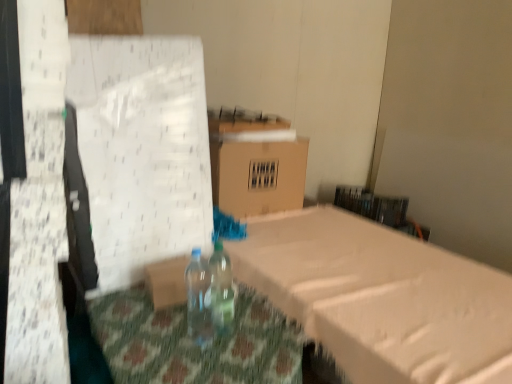
In order to face brown cardboard box at center, should I rotate leftwards or rightwards?

Rotate left and turn 0.758 degrees.

What do you see at coordinates (199, 299) in the screenshot?
I see `translucent plastic bottle at center, which is the second bottle in right-to-left order` at bounding box center [199, 299].

How much space does transparent plastic bottle at center, the 2th bottle when ordered from left to right, occupy horizontally?

3.36 inches.

The image size is (512, 384). I want to click on brown cardboard box at center, so click(255, 163).

Does point (292, 158) appear closer or farther from the camera than point (199, 304)?

Point (292, 158).

Which object is positioned more to the left, brown cardboard box at center or translucent plastic bottle at center, the 1th bottle from the left?

translucent plastic bottle at center, the 1th bottle from the left, is more to the left.

Is brown cardboard box at center not inside translucent plastic bottle at center, which is the second bottle in right-to-left order?

Yes, brown cardboard box at center is outside of translucent plastic bottle at center, which is the second bottle in right-to-left order.

Is brown cardboard box at center positioned behind translucent plastic bottle at center, the 1th bottle from the left?

Yes, brown cardboard box at center is behind translucent plastic bottle at center, the 1th bottle from the left.

This screenshot has height=384, width=512. I want to click on cardboard box on the right side of transparent plastic bottle at center, the first bottle when ordered from right to left, so click(x=255, y=163).

Between point (229, 267) and point (271, 176), which one is positioned behind?

The point (271, 176) is behind.

Looking at this image, from a real-world perspective, is transparent plastic bottle at center, the 2th bottle when ordered from left to right, located beneath brown cardboard box at center?

Yes, from a real-world perspective, transparent plastic bottle at center, the 2th bottle when ordered from left to right, is under brown cardboard box at center.

Is transparent plastic bottle at center, the 2th bottle when ordered from left to right, wider than brown cardboard box at center?

No, transparent plastic bottle at center, the 2th bottle when ordered from left to right, is not wider than brown cardboard box at center.

Can you confirm if brown cardboard box at center is taller than transparent plastic bottle at center, the 2th bottle when ordered from left to right?

Correct, brown cardboard box at center is much taller as transparent plastic bottle at center, the 2th bottle when ordered from left to right.

Is there a large distance between brown cardboard box at center and transparent plastic bottle at center, the 2th bottle when ordered from left to right?

No, brown cardboard box at center is in close proximity to transparent plastic bottle at center, the 2th bottle when ordered from left to right.

Who is smaller, brown cardboard box at center or transparent plastic bottle at center, the 2th bottle when ordered from left to right?

transparent plastic bottle at center, the 2th bottle when ordered from left to right.

Considering the sizes of objects brown cardboard box at center and transparent plastic bottle at center, the first bottle when ordered from right to left, in the image provided, who is wider, brown cardboard box at center or transparent plastic bottle at center, the first bottle when ordered from right to left,?

brown cardboard box at center is wider.

Is translucent plastic bottle at center, the 1th bottle from the left, positioned with its back to transparent plastic bottle at center, the first bottle when ordered from right to left?

No, translucent plastic bottle at center, the 1th bottle from the left,'s orientation is not away from transparent plastic bottle at center, the first bottle when ordered from right to left.

Considering the relative positions of translucent plastic bottle at center, the 1th bottle from the left, and transparent plastic bottle at center, the first bottle when ordered from right to left, in the image provided, is translucent plastic bottle at center, the 1th bottle from the left, behind transparent plastic bottle at center, the first bottle when ordered from right to left,?

No, translucent plastic bottle at center, the 1th bottle from the left, is closer to the camera.

In the scene shown: Between translucent plastic bottle at center, which is the second bottle in right-to-left order, and transparent plastic bottle at center, the first bottle when ordered from right to left, which one has less height?

transparent plastic bottle at center, the first bottle when ordered from right to left, is shorter.

From a real-world perspective, between translucent plastic bottle at center, which is the second bottle in right-to-left order, and brown cardboard box at center, who is vertically lower?

translucent plastic bottle at center, which is the second bottle in right-to-left order, from a real-world perspective.

You are a GUI agent. You are given a task and a screenshot of the screen. Output one action in this format:
    pyautogui.click(x=<x>, y=<y>)
    Task: Click on the cardboard box that is above the translucent plastic bottle at center, the 1th bottle from the left (from a real-world perspective)
    
    Given the screenshot: What is the action you would take?
    pyautogui.click(x=255, y=163)

Between translucent plastic bottle at center, which is the second bottle in right-to-left order, and brown cardboard box at center, which one has smaller size?

translucent plastic bottle at center, which is the second bottle in right-to-left order, is smaller.

Can you tell me how much transparent plastic bottle at center, the first bottle when ordered from right to left, and translucent plastic bottle at center, the 1th bottle from the left, differ in facing direction?

0.000565 degrees separate the facing orientations of transparent plastic bottle at center, the first bottle when ordered from right to left, and translucent plastic bottle at center, the 1th bottle from the left.

Does transparent plastic bottle at center, the first bottle when ordered from right to left, have a lesser width compared to translucent plastic bottle at center, which is the second bottle in right-to-left order?

Correct, the width of transparent plastic bottle at center, the first bottle when ordered from right to left, is less than that of translucent plastic bottle at center, which is the second bottle in right-to-left order.

Is transparent plastic bottle at center, the first bottle when ordered from right to left, not inside translucent plastic bottle at center, which is the second bottle in right-to-left order?

Yes, transparent plastic bottle at center, the first bottle when ordered from right to left, is not within translucent plastic bottle at center, which is the second bottle in right-to-left order.

Is there a large distance between transparent plastic bottle at center, the 2th bottle when ordered from left to right, and translucent plastic bottle at center, the 1th bottle from the left?

Actually, transparent plastic bottle at center, the 2th bottle when ordered from left to right, and translucent plastic bottle at center, the 1th bottle from the left, are a little close together.

Find the location of a particular element. bottle that is the 2nd object to the left of the brown cardboard box at center, starting at the anchor is located at coordinates (199, 299).

Identify the location of the 1st bottle in front of the brown cardboard box at center. (222, 290).

Considering their positions, is brown cardboard box at center positioned further to translucent plastic bottle at center, the 1th bottle from the left, than transparent plastic bottle at center, the first bottle when ordered from right to left?

brown cardboard box at center is positioned further to the anchor translucent plastic bottle at center, the 1th bottle from the left.

Based on the photo, which object lies nearer to the anchor point transparent plastic bottle at center, the first bottle when ordered from right to left, brown cardboard box at center or translucent plastic bottle at center, the 1th bottle from the left?

translucent plastic bottle at center, the 1th bottle from the left, is closer to transparent plastic bottle at center, the first bottle when ordered from right to left.

Based on their spatial positions, is translucent plastic bottle at center, which is the second bottle in right-to-left order, or brown cardboard box at center further from transparent plastic bottle at center, the 2th bottle when ordered from left to right?

brown cardboard box at center is further to transparent plastic bottle at center, the 2th bottle when ordered from left to right.

From the image, which object appears to be farther from brown cardboard box at center, translucent plastic bottle at center, the 1th bottle from the left, or transparent plastic bottle at center, the 2th bottle when ordered from left to right?

translucent plastic bottle at center, the 1th bottle from the left, lies further to brown cardboard box at center than the other object.

Estimate the real-world distances between objects in this image. Which object is further from brown cardboard box at center, transparent plastic bottle at center, the 2th bottle when ordered from left to right, or translucent plastic bottle at center, which is the second bottle in right-to-left order?

translucent plastic bottle at center, which is the second bottle in right-to-left order, is further to brown cardboard box at center.

Estimate the real-world distances between objects in this image. Which object is closer to translucent plastic bottle at center, the 1th bottle from the left, transparent plastic bottle at center, the 2th bottle when ordered from left to right, or brown cardboard box at center?

Based on the image, transparent plastic bottle at center, the 2th bottle when ordered from left to right, appears to be nearer to translucent plastic bottle at center, the 1th bottle from the left.

Where is `bottle between translucent plastic bottle at center, the 1th bottle from the left, and brown cardboard box at center from front to back`? The width and height of the screenshot is (512, 384). bottle between translucent plastic bottle at center, the 1th bottle from the left, and brown cardboard box at center from front to back is located at coordinates (222, 290).